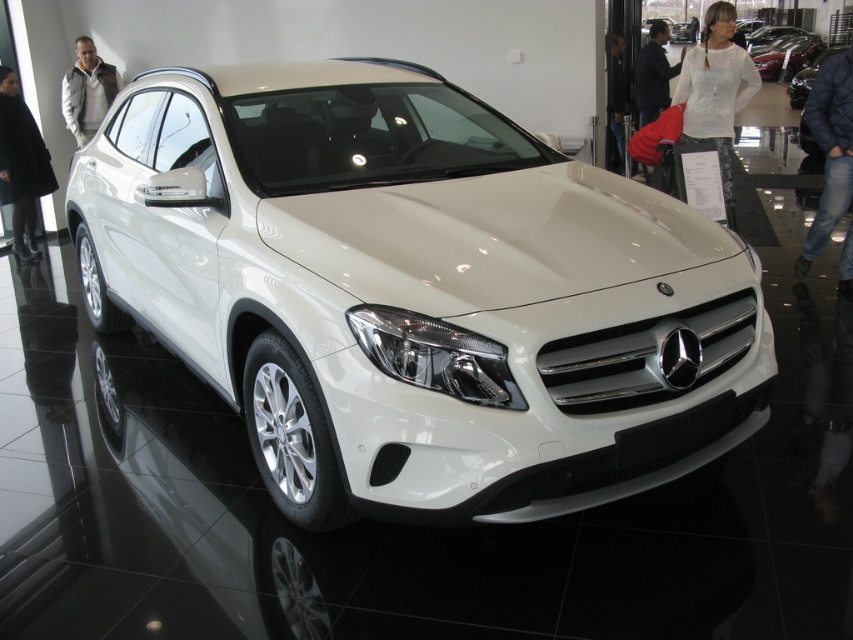
Who is taller, white glossy suv at center or white lace blouse at upper center?

white glossy suv at center

Which is above, white glossy suv at center or white lace blouse at upper center?

white lace blouse at upper center

Measure the distance between white glossy suv at center and camera.

The distance of white glossy suv at center from camera is 7.36 feet.

Identify the location of white glossy suv at center. This screenshot has height=640, width=853. pos(416,292).

Is point (1, 172) less distant than point (819, 42)?

Yes, point (1, 172) is in front of point (819, 42).

Which of these two, black wool coat at left or glossy metallic car at upper right, stands shorter?

black wool coat at left is shorter.

Who is more forward, (x=32, y=244) or (x=793, y=68)?

Positioned in front is point (x=32, y=244).

Locate an element on the screen. black wool coat at left is located at coordinates (21, 164).

Can you confirm if white lace blouse at upper center is positioned to the left of black leather jacket at upper center?

Indeed, white lace blouse at upper center is positioned on the left side of black leather jacket at upper center.

Can you confirm if white lace blouse at upper center is smaller than black leather jacket at upper center?

Correct, white lace blouse at upper center occupies less space than black leather jacket at upper center.

Find the location of a particular element. white lace blouse at upper center is located at coordinates (717, 90).

Find the location of a particular element. The height and width of the screenshot is (640, 853). white lace blouse at upper center is located at coordinates 717,90.